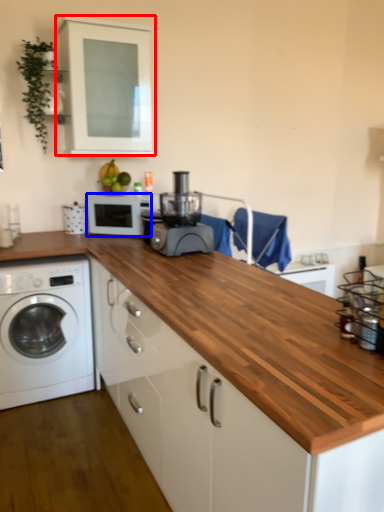
Question: Among these objects, which one is farthest to the camera, cabinetry (highlighted by a red box) or microwave oven (highlighted by a blue box)?

Choices:
 (A) cabinetry
 (B) microwave oven

Answer: (B)